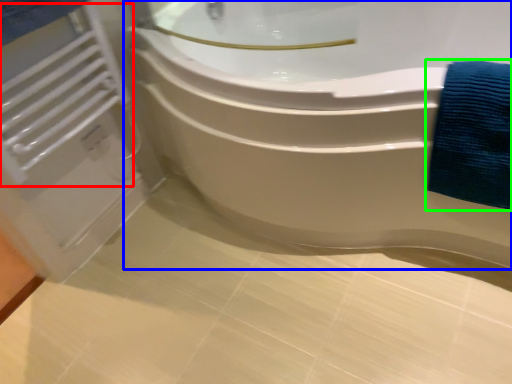
Question: Estimate the real-world distances between objects in this image. Which object is farther from radiator (highlighted by a red box), bathtub (highlighted by a blue box) or bath towel (highlighted by a green box)?

Choices:
 (A) bathtub
 (B) bath towel

Answer: (B)